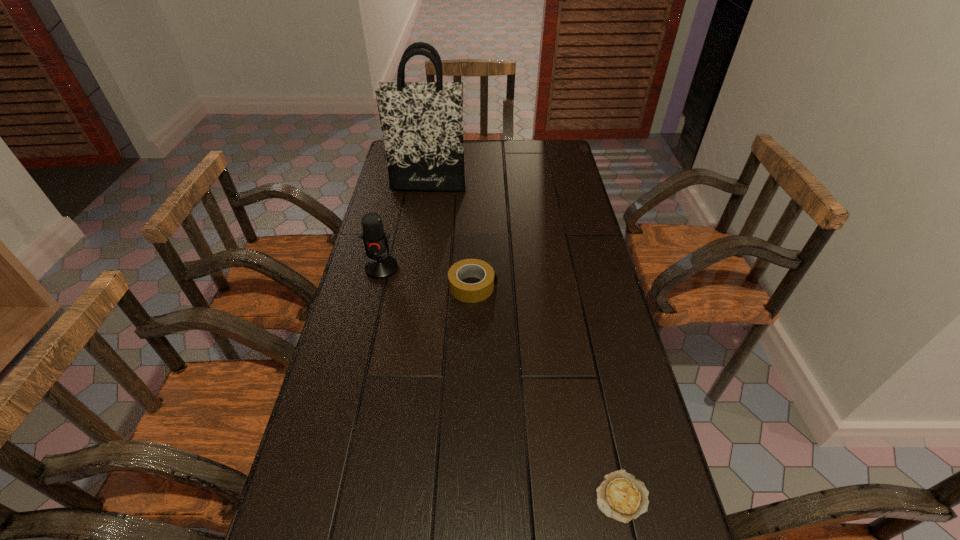
Find the location of `the farthest object`. the farthest object is located at coordinates (422, 122).

I want to click on the tallest object, so click(x=422, y=122).

Where is `microphone`? microphone is located at coordinates (379, 266).

Image resolution: width=960 pixels, height=540 pixels. In order to click on the third tallest object in this screenshot , I will do `click(470, 293)`.

Find the location of a particular element. the shortest object is located at coordinates (621, 496).

You are a GUI agent. You are given a task and a screenshot of the screen. Output one action in this format:
    pyautogui.click(x=<x>, y=<y>)
    Task: Click on the rightmost object
    
    Given the screenshot: What is the action you would take?
    [621, 496]

The image size is (960, 540). I want to click on free spot located on the front of the tallest object with the design, so click(424, 209).

The height and width of the screenshot is (540, 960). I want to click on vacant position located on the side of the microphone with the red ring, so click(371, 314).

The width and height of the screenshot is (960, 540). Identify the location of blank area located 0.150m at the edge of the duct tape. (546, 287).

In order to click on vacant area situated on the back of the nearest object in this screenshot , I will do `click(591, 359)`.